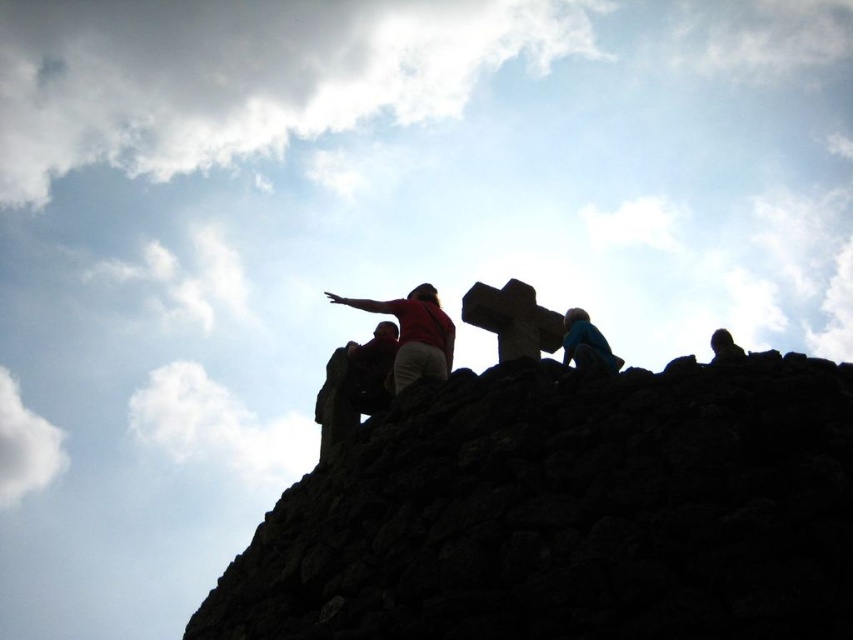
You are a photographer aiming to capture the dark stone wall at upper center and the matte red arm at upper center in a single shot. Considering their sizes, which object will occupy more space in the photo?

The dark stone wall at upper center will occupy more space in the photo because it has a larger size compared to the matte red arm at upper center.

You are a photographer trying to capture a group photo of the matte red shirt at center and the blue fabric person at upper center. Which subject should you focus on first if you want to ensure both are in frame without moving the camera? Explain your reasoning based on their sizes.

The matte red shirt at center is larger in size compared to the blue fabric person at upper center. Therefore, focusing on the matte red shirt at center first would help ensure both subjects are within the camera frame since it occupies more space and adjusting the shot around it would naturally include the smaller blue fabric person at upper center.